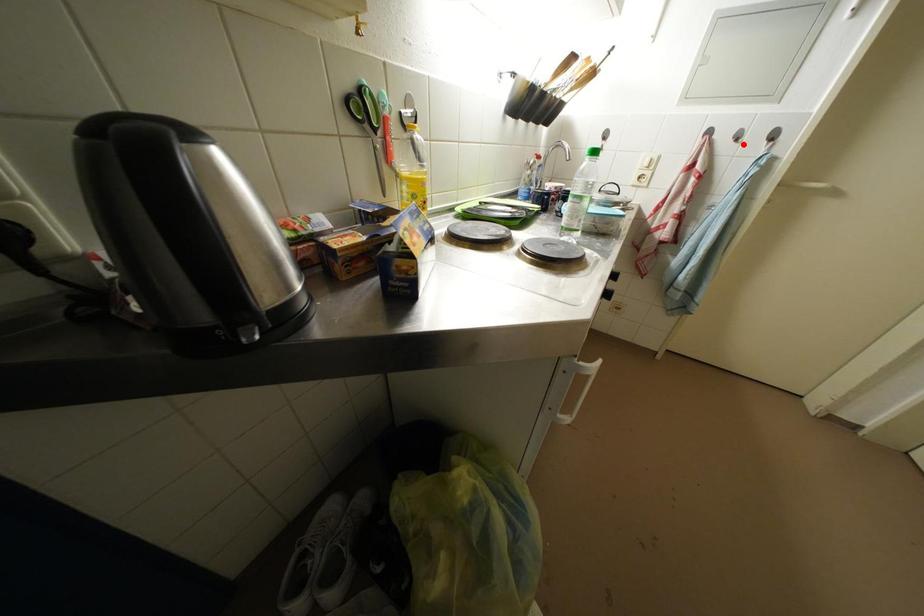
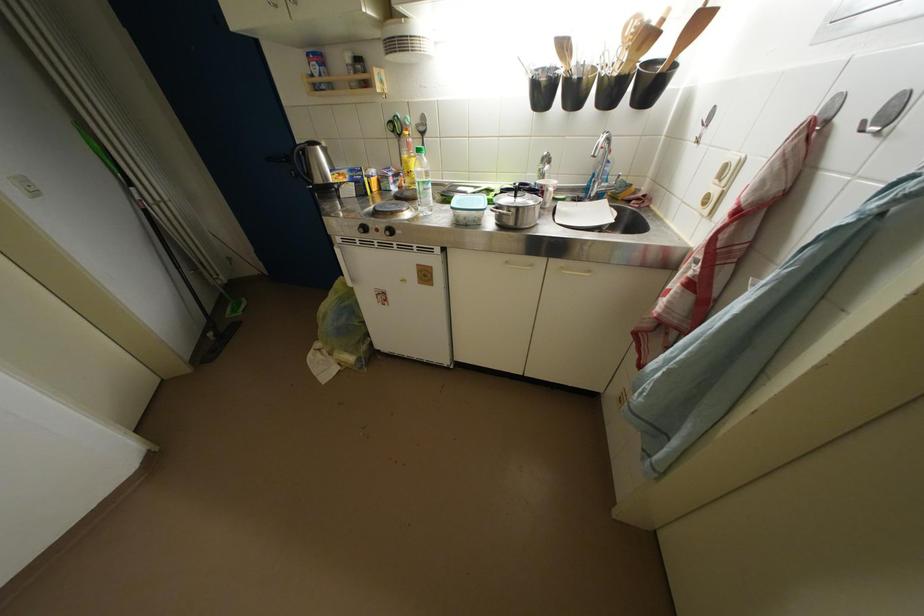
The point at the highlighted location is marked in the first image. Where is the corresponding point in the second image?

(869, 132)